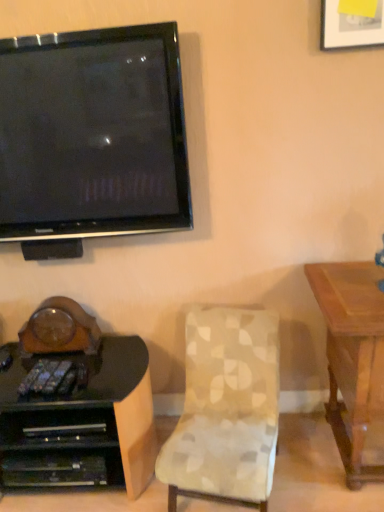
Question: Should I look upward or downward to see black glossy desk at lower left?

Choices:
 (A) down
 (B) up

Answer: (A)

Question: Does black glossy desk at lower left have a greater height compared to patterned fabric chair at center?

Choices:
 (A) no
 (B) yes

Answer: (A)

Question: From the image's perspective, is black glossy desk at lower left below patterned fabric chair at center?

Choices:
 (A) yes
 (B) no

Answer: (A)

Question: Is black glossy desk at lower left completely or partially outside of patterned fabric chair at center?

Choices:
 (A) no
 (B) yes

Answer: (B)

Question: Does black glossy desk at lower left have a lesser width compared to patterned fabric chair at center?

Choices:
 (A) no
 (B) yes

Answer: (B)

Question: Does black glossy desk at lower left have a lesser height compared to patterned fabric chair at center?

Choices:
 (A) yes
 (B) no

Answer: (A)

Question: Would you consider black glossy desk at lower left to be distant from patterned fabric chair at center?

Choices:
 (A) yes
 (B) no

Answer: (B)

Question: Is black glossy television at upper left directly adjacent to black glossy desk at lower left?

Choices:
 (A) no
 (B) yes

Answer: (A)

Question: Is black glossy television at upper left looking in the opposite direction of black glossy desk at lower left?

Choices:
 (A) no
 (B) yes

Answer: (A)

Question: Does black glossy television at upper left have a lesser width compared to black glossy desk at lower left?

Choices:
 (A) no
 (B) yes

Answer: (B)

Question: Can you confirm if black glossy television at upper left is wider than black glossy desk at lower left?

Choices:
 (A) yes
 (B) no

Answer: (B)

Question: Considering the relative sizes of black glossy television at upper left and black glossy desk at lower left in the image provided, is black glossy television at upper left bigger than black glossy desk at lower left?

Choices:
 (A) yes
 (B) no

Answer: (B)

Question: From the image's perspective, is black glossy television at upper left beneath black glossy desk at lower left?

Choices:
 (A) yes
 (B) no

Answer: (B)

Question: From a real-world perspective, is patterned fabric chair at center under black glossy television at upper left?

Choices:
 (A) no
 (B) yes

Answer: (B)